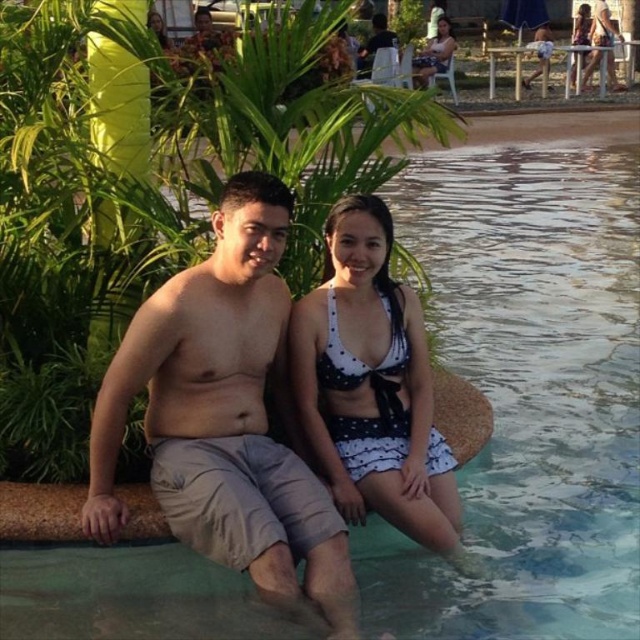
Question: Which object is the closest to the white dotted fabric bikini top at center?

Choices:
 (A) tan cotton shorts at center
 (B) white polka dot bikini at upper center

Answer: (A)

Question: Estimate the real-world distances between objects in this image. Which object is farther from the white dotted fabric bikini at center?

Choices:
 (A) white polka dot bikini at center
 (B) black matte shorts at lower center

Answer: (A)

Question: Can you confirm if white polka dot bikini at upper right is positioned above black matte shorts at lower center?

Choices:
 (A) yes
 (B) no

Answer: (A)

Question: Is black matte shorts at lower center in front of white polka dot bikini at upper center?

Choices:
 (A) no
 (B) yes

Answer: (B)

Question: Which point is closer to the camera?

Choices:
 (A) (385, 42)
 (B) (248, 387)
 (C) (385, 378)

Answer: (B)

Question: Is tan cotton shorts at center behind white dotted fabric bikini top at center?

Choices:
 (A) yes
 (B) no

Answer: (B)